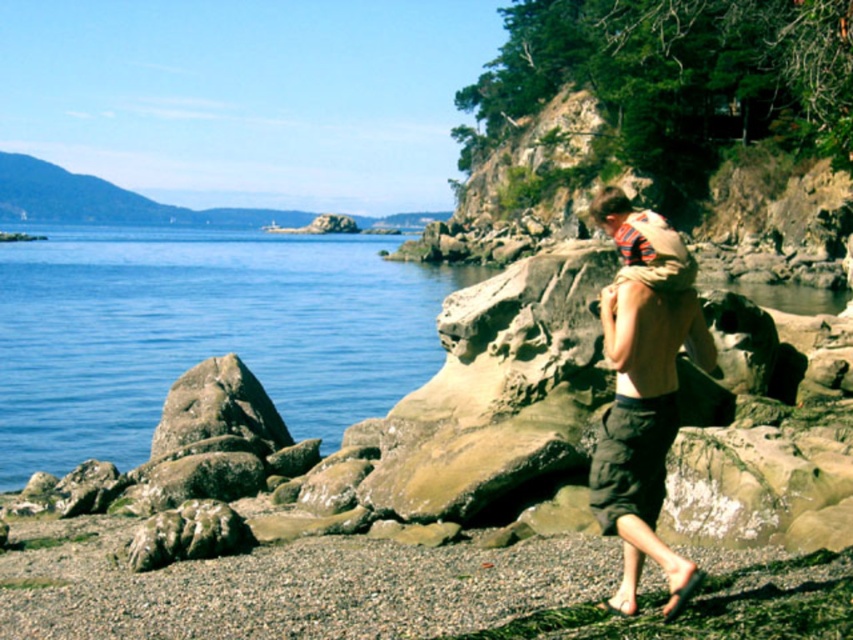
Question: Which of the following is the closest to the observer?

Choices:
 (A) (659, 492)
 (B) (61, 365)
 (C) (625, 304)

Answer: (A)

Question: Which point is farther to the camera?

Choices:
 (A) brown fabric shirt at center
 (B) rough textured rock at left
 (C) blue smooth water at left

Answer: (C)

Question: Can you confirm if dark brown cotton shorts at lower right is bigger than rough textured rock at left?

Choices:
 (A) yes
 (B) no

Answer: (B)

Question: From the image, what is the correct spatial relationship of brown fabric shirt at center in relation to dark brown cotton shorts at lower right?

Choices:
 (A) right
 (B) left

Answer: (A)

Question: Is blue smooth water at left below rough textured rock at left?

Choices:
 (A) no
 (B) yes

Answer: (A)

Question: Which of the following is the closest to the observer?

Choices:
 (A) (633, 440)
 (B) (631, 316)
 (C) (630, 460)

Answer: (C)